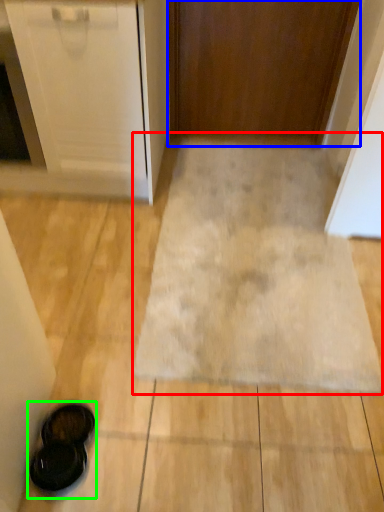
Question: Based on their relative distances, which object is farther from bath mat (highlighted by a red box)? Choose from door (highlighted by a blue box) and footwear (highlighted by a green box).

Choices:
 (A) door
 (B) footwear

Answer: (A)